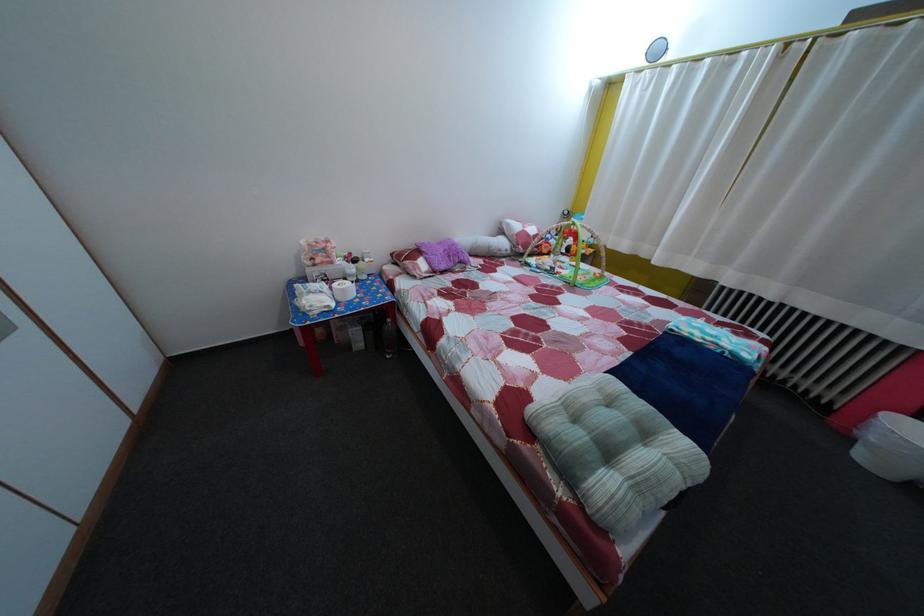
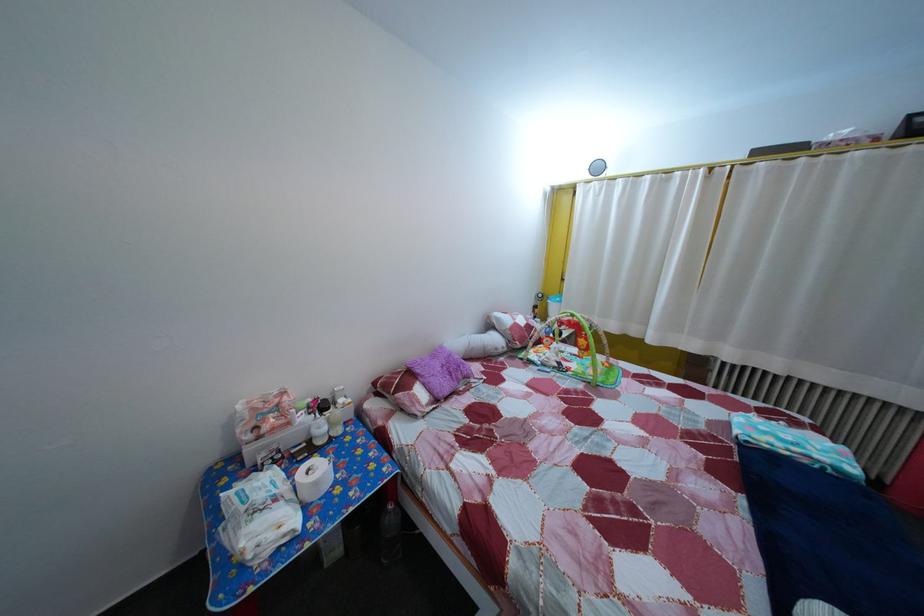
Where in the second image is the point corresponding to point (342, 270) from the first image?

(298, 432)